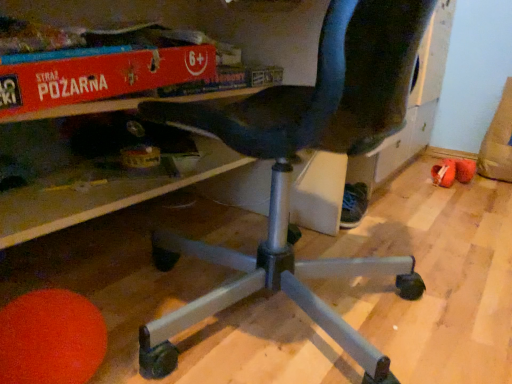
Where is `vacant space that's between orange fabric shoe at lower right, marked as the 1th footwear in a right-to-left arrangement, and black fabric shoe at lower center, the second footwear from the back`? This screenshot has height=384, width=512. vacant space that's between orange fabric shoe at lower right, marked as the 1th footwear in a right-to-left arrangement, and black fabric shoe at lower center, the second footwear from the back is located at coordinates (398, 205).